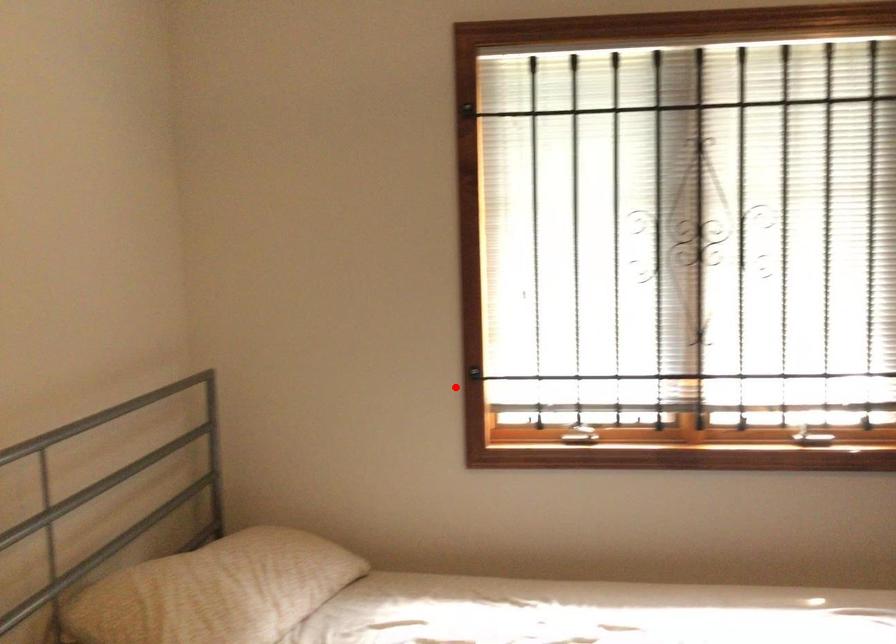
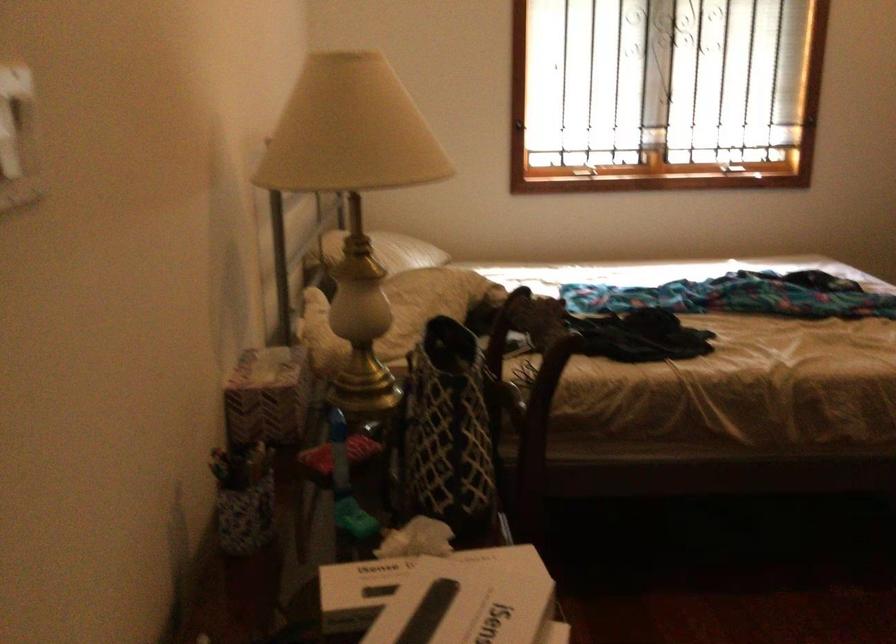
Question: I am providing you with two images of the same scene from different viewpoints. A red point is shown in image1. For the corresponding object point in image2, is it positioned nearer or farther from the camera?

Choices:
 (A) Nearer
 (B) Farther

Answer: (B)